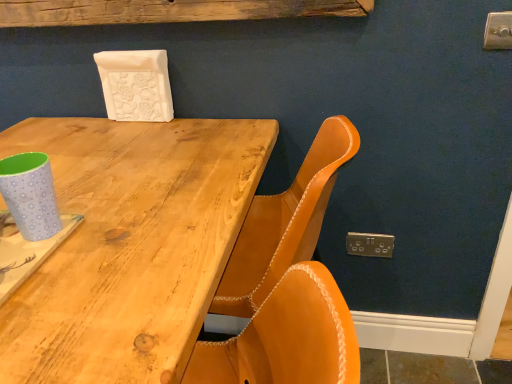
Where is `vacant area that is situated to the right of light blue polka dot paper cup at left`? vacant area that is situated to the right of light blue polka dot paper cup at left is located at coordinates (128, 239).